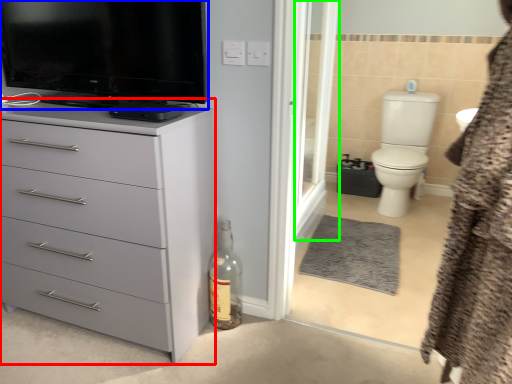
Question: Which object is the farthest from chest of drawers (highlighted by a red box)? Choose among these: television (highlighted by a blue box) or screen door (highlighted by a green box).

Choices:
 (A) television
 (B) screen door

Answer: (B)